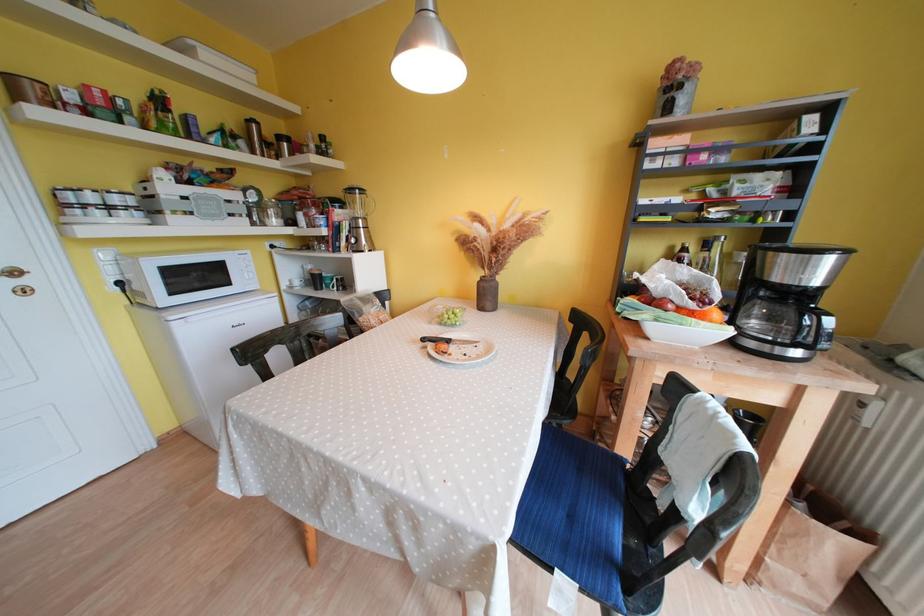
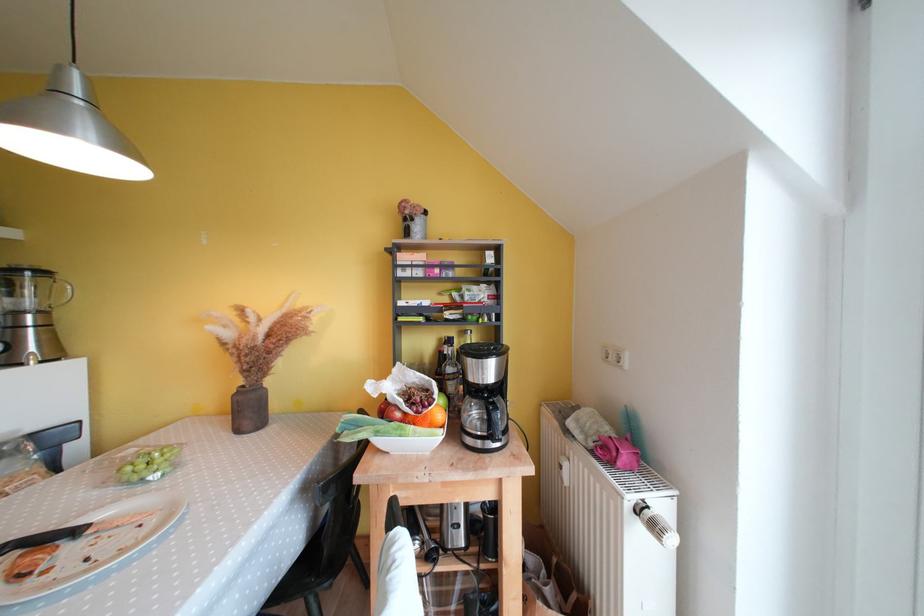
The point at (371, 223) is marked in the first image. Where is the corresponding point in the second image?

(49, 315)